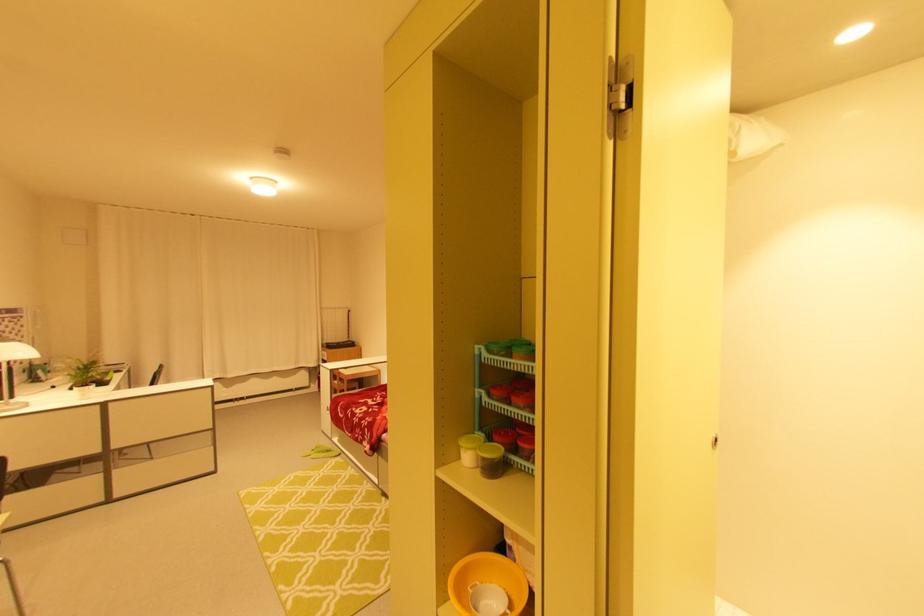
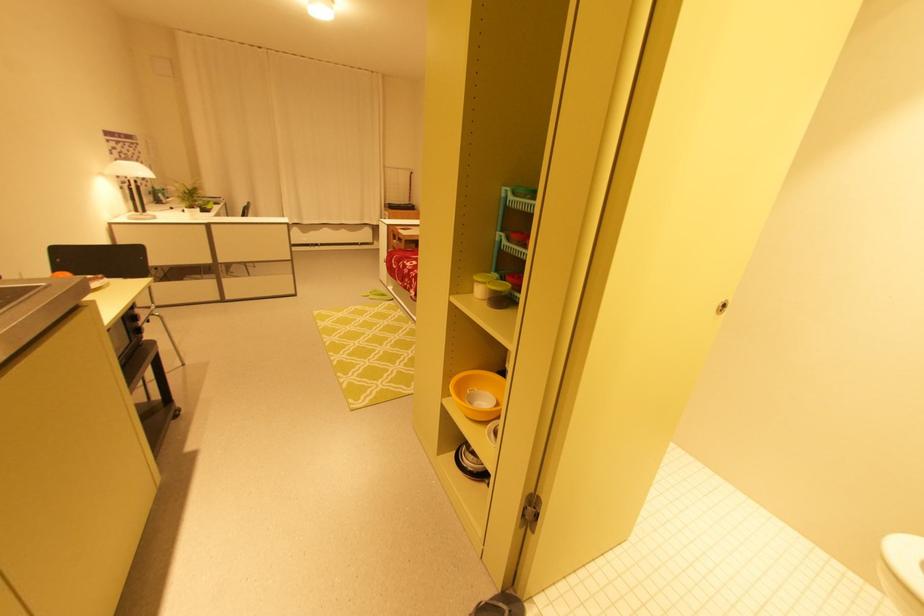
Find the pixel in the second image that matches the point at 482,583 in the first image.

(480, 390)